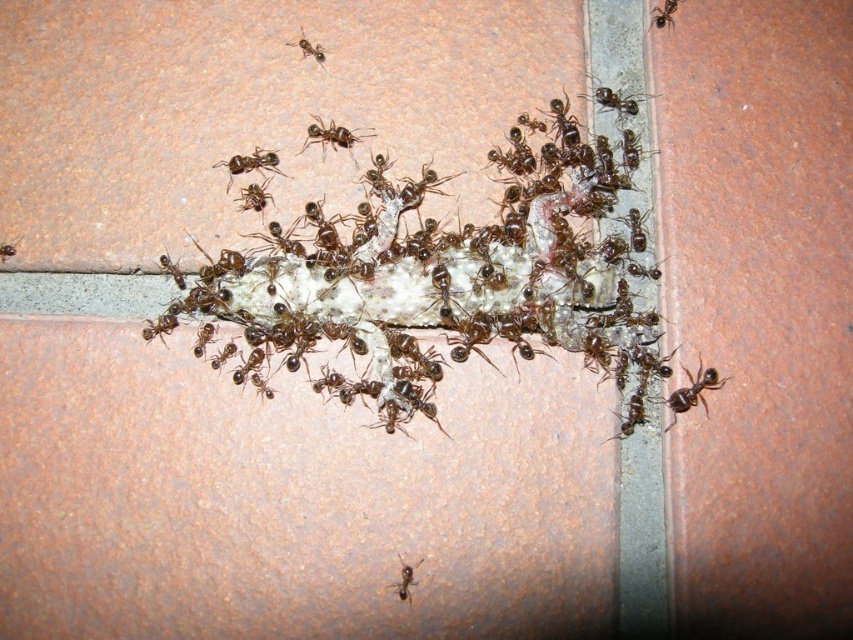
Can you confirm if brown matte ant at lower center is taller than brown shiny ant at upper center?

In fact, brown matte ant at lower center may be shorter than brown shiny ant at upper center.

Looking at this image, is brown matte ant at lower center closer to the viewer compared to brown shiny ant at upper center?

That is True.

I want to click on brown matte ant at lower center, so click(404, 579).

I want to click on brown matte ant at lower center, so click(404, 579).

Does brown glossy ant at upper center have a lesser width compared to brown shiny ant at upper center?

In fact, brown glossy ant at upper center might be wider than brown shiny ant at upper center.

Which is below, brown glossy ant at upper center or brown shiny ant at upper center?

brown glossy ant at upper center is lower down.

The image size is (853, 640). What do you see at coordinates (614, 99) in the screenshot? I see `brown glossy ant at upper center` at bounding box center [614, 99].

In order to click on brown glossy ant at upper center in this screenshot , I will do point(614,99).

Does brown glossy ant at lower right have a smaller size compared to brown shiny ant at upper center?

Incorrect, brown glossy ant at lower right is not smaller in size than brown shiny ant at upper center.

Between brown glossy ant at lower right and brown shiny ant at upper center, which one is positioned higher?

brown shiny ant at upper center

Is point (705, 406) positioned after point (321, 52)?

No, it is in front of (321, 52).

This screenshot has height=640, width=853. In order to click on brown glossy ant at lower right in this screenshot , I will do `click(691, 392)`.